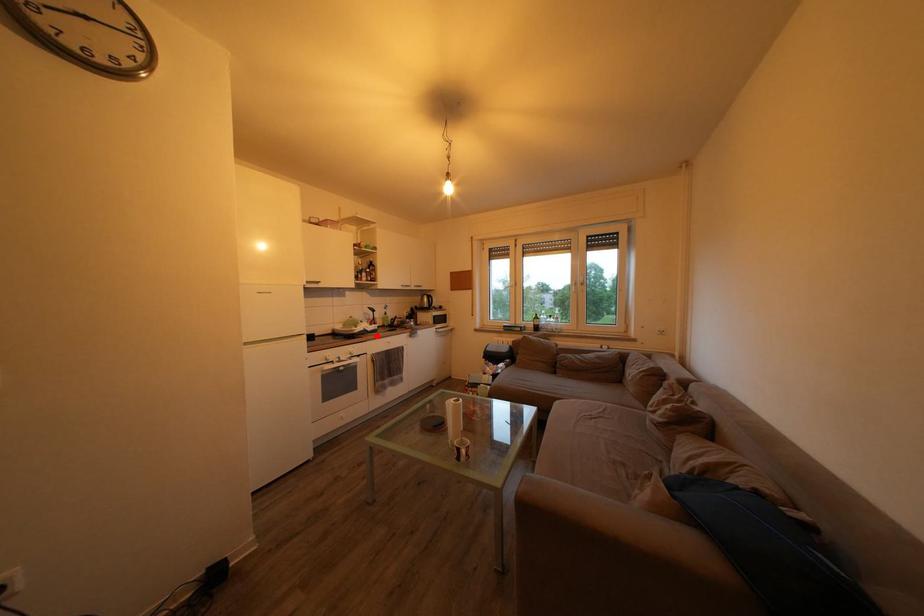
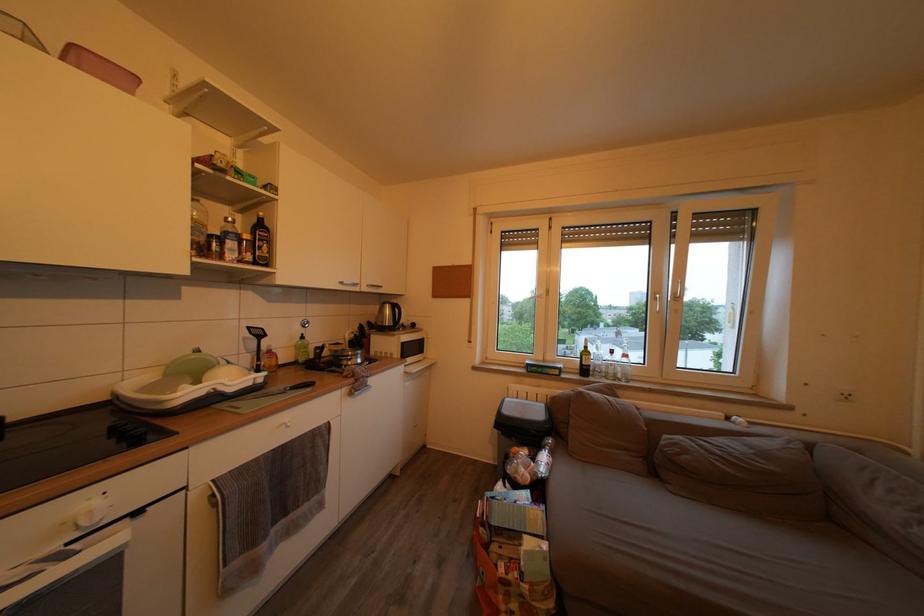
Where in the second image is the point corresponding to the highlighted location from the first image?

(238, 397)